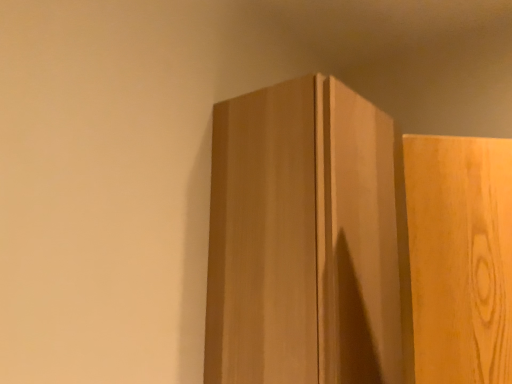
Locate an element on the screen. light brown wood cupboard at upper right is located at coordinates (354, 245).

What is the approximate width of light brown wood cupboard at upper right?

It is 12.56 inches.

Image resolution: width=512 pixels, height=384 pixels. Describe the element at coordinates (354, 245) in the screenshot. I see `light brown wood cupboard at upper right` at that location.

Locate an element on the screen. Image resolution: width=512 pixels, height=384 pixels. light brown wood cupboard at upper right is located at coordinates (354, 245).